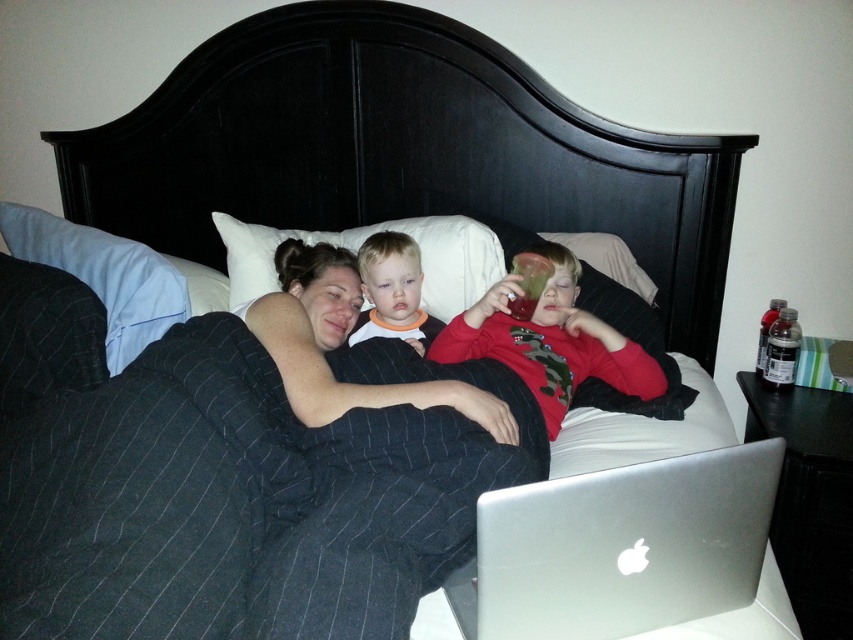
Can you confirm if white soft pillow at center is bigger than smooth orange shirt at center?

Correct, white soft pillow at center is larger in size than smooth orange shirt at center.

Does white soft pillow at center come in front of smooth orange shirt at center?

No, white soft pillow at center is behind smooth orange shirt at center.

Is point (436, 218) positioned before point (370, 317)?

No, (436, 218) is behind (370, 317).

Where is `white soft pillow at center`? The width and height of the screenshot is (853, 640). white soft pillow at center is located at coordinates (358, 248).

What do you see at coordinates (549, 340) in the screenshot? I see `red matte shirt at center` at bounding box center [549, 340].

Find the location of a particular element. red matte shirt at center is located at coordinates (549, 340).

I want to click on red matte shirt at center, so click(549, 340).

Does dark wood headboard at upper center have a greater width compared to blue fabric pillow at upper left?

Yes.

Between point (642, 244) and point (178, 289), which one is positioned in front?

Point (178, 289) is in front.

Find the location of a particular element. dark wood headboard at upper center is located at coordinates (399, 148).